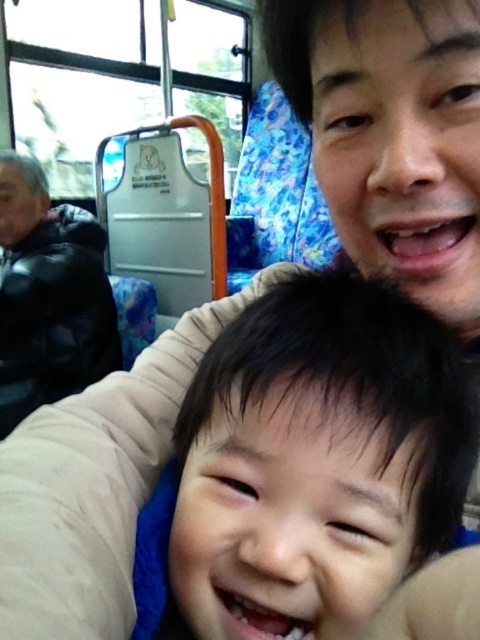
Can you confirm if black matte hair at center is positioned above black fuzzy jacket at left?

No, black matte hair at center is not above black fuzzy jacket at left.

In order to click on black matte hair at center in this screenshot , I will do `click(307, 456)`.

What are the coordinates of `black matte hair at center` in the screenshot? It's located at (307, 456).

This screenshot has width=480, height=640. What are the coordinates of `black matte hair at center` in the screenshot? It's located at (307, 456).

Between point (428, 212) and point (51, 237), which one is positioned behind?

Positioned behind is point (51, 237).

Can you confirm if smooth skin face at upper right is smaller than black fuzzy jacket at left?

Yes, smooth skin face at upper right is smaller than black fuzzy jacket at left.

The height and width of the screenshot is (640, 480). Find the location of `smooth skin face at upper right`. smooth skin face at upper right is located at coordinates (392, 132).

From the picture: Who is positioned more to the right, black matte hair at center or smooth skin face at upper right?

smooth skin face at upper right

Which is above, black matte hair at center or smooth skin face at upper right?

smooth skin face at upper right is higher up.

Find the location of a particular element. The height and width of the screenshot is (640, 480). black matte hair at center is located at coordinates (307, 456).